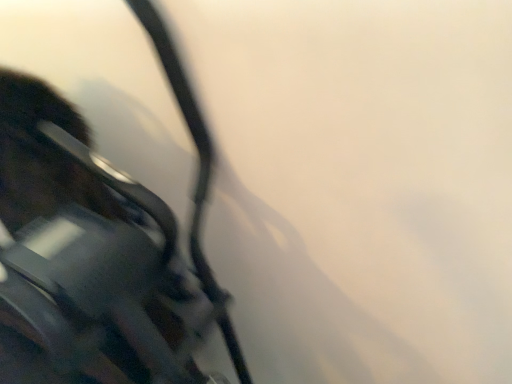
Where is `matte black headphones at left`? The image size is (512, 384). matte black headphones at left is located at coordinates (98, 249).

What do you see at coordinates (98, 249) in the screenshot? I see `matte black headphones at left` at bounding box center [98, 249].

Identify the location of matte black headphones at left. The height and width of the screenshot is (384, 512). (98, 249).